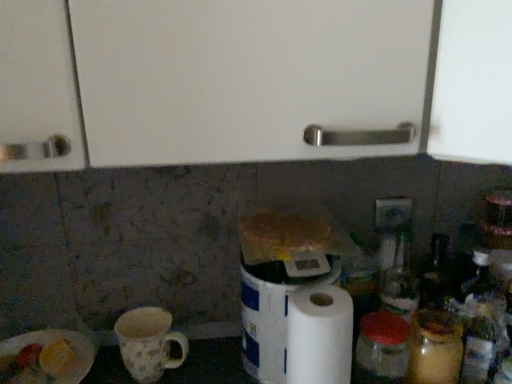
Question: Is white matte paper towel at center-right turned away from floral ceramic mug at lower left?

Choices:
 (A) no
 (B) yes

Answer: (A)

Question: Is white matte paper towel at center-right outside floral ceramic mug at lower left?

Choices:
 (A) no
 (B) yes

Answer: (B)

Question: Is white matte paper towel at center-right facing towards floral ceramic mug at lower left?

Choices:
 (A) no
 (B) yes

Answer: (A)

Question: From a real-world perspective, is white matte paper towel at center-right located beneath floral ceramic mug at lower left?

Choices:
 (A) no
 (B) yes

Answer: (A)

Question: Is white matte paper towel at center-right far from floral ceramic mug at lower left?

Choices:
 (A) no
 (B) yes

Answer: (A)

Question: Can you confirm if white matte paper towel at center-right is bigger than floral ceramic mug at lower left?

Choices:
 (A) yes
 (B) no

Answer: (A)

Question: Is green plastic electric outlet at upper right thinner than white matte paper towel at center-right?

Choices:
 (A) no
 (B) yes

Answer: (B)

Question: From a real-world perspective, is green plastic electric outlet at upper right on top of white matte paper towel at center-right?

Choices:
 (A) no
 (B) yes

Answer: (B)

Question: Is white matte paper towel at center-right surrounded by green plastic electric outlet at upper right?

Choices:
 (A) yes
 (B) no

Answer: (B)

Question: Can you confirm if green plastic electric outlet at upper right is taller than white matte paper towel at center-right?

Choices:
 (A) no
 (B) yes

Answer: (A)

Question: From the image's perspective, would you say green plastic electric outlet at upper right is shown under white matte paper towel at center-right?

Choices:
 (A) yes
 (B) no

Answer: (B)

Question: Is green plastic electric outlet at upper right next to white matte paper towel at center-right?

Choices:
 (A) no
 (B) yes

Answer: (A)

Question: Considering the relative sizes of white paper towel at center and green plastic electric outlet at upper right in the image provided, is white paper towel at center wider than green plastic electric outlet at upper right?

Choices:
 (A) no
 (B) yes

Answer: (B)